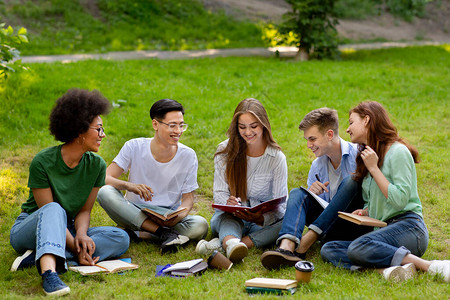
Find the location of a particular element. coffee cup is located at coordinates (306, 273), (228, 260).